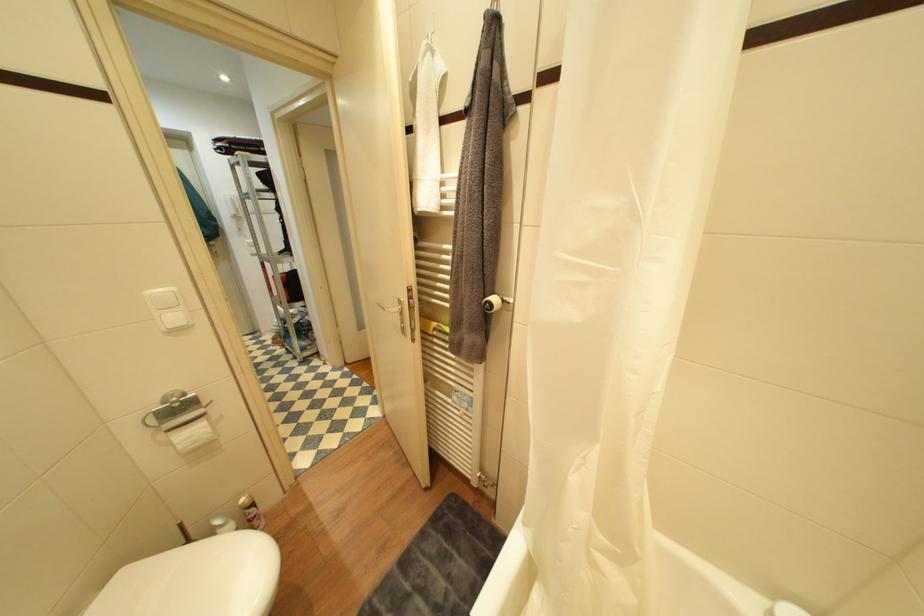
Where is `double light switch`? The image size is (924, 616). double light switch is located at coordinates (167, 309).